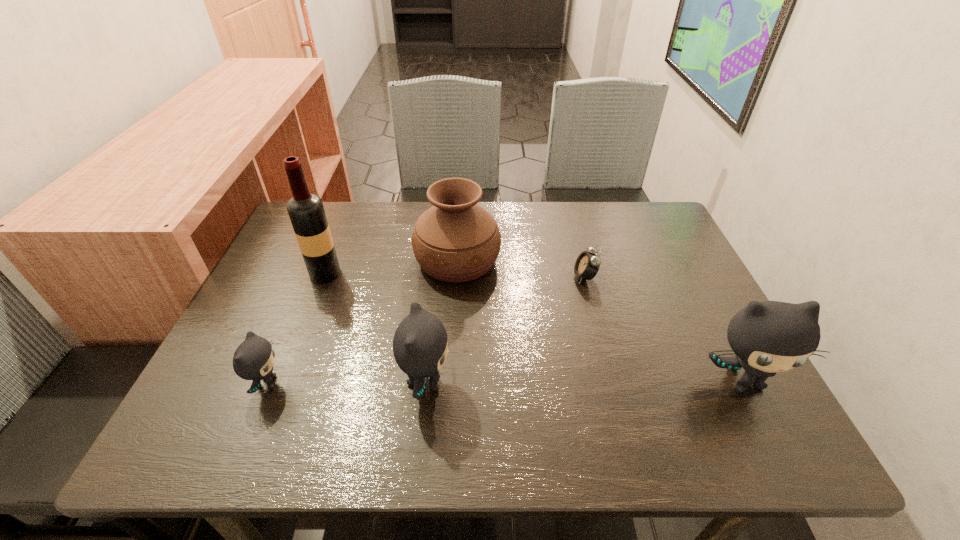
Find the location of a particular element. free spot between the urn and the third shortest object is located at coordinates (442, 321).

I want to click on unoccupied area between the second shortest object and the rightmost kitten, so click(505, 382).

Where is `empty space that is in between the third shortest object and the fifth object from left to right`? Image resolution: width=960 pixels, height=540 pixels. empty space that is in between the third shortest object and the fifth object from left to right is located at coordinates (505, 329).

What are the coordinates of `vacant region between the urn and the third shortest object` in the screenshot? It's located at (442, 321).

Locate an element on the screen. The image size is (960, 540). free space between the shortest kitten and the tallest object is located at coordinates (296, 328).

Where is `vacant area between the rightmost object and the tallest object`? vacant area between the rightmost object and the tallest object is located at coordinates tap(534, 327).

At what (x,y) coordinates should I click in order to perform the action: click on empty space between the rightmost object and the second kitten from right to left. Please return your answer as a coordinate pair (x, y). Looking at the image, I should click on (585, 381).

Locate an element on the screen. This screenshot has width=960, height=540. free space that is in between the tallest object and the urn is located at coordinates (392, 267).

Identify the location of object that can be found as the fourth closest to the urn. This screenshot has height=540, width=960. (254, 358).

Locate which object ranks second in proximity to the urn. Please provide its 2D coordinates. Your answer should be formatted as a tuple, i.e. [(x, y)], where the tuple contains the x and y coordinates of a point satisfying the conditions above.

[(587, 264)]